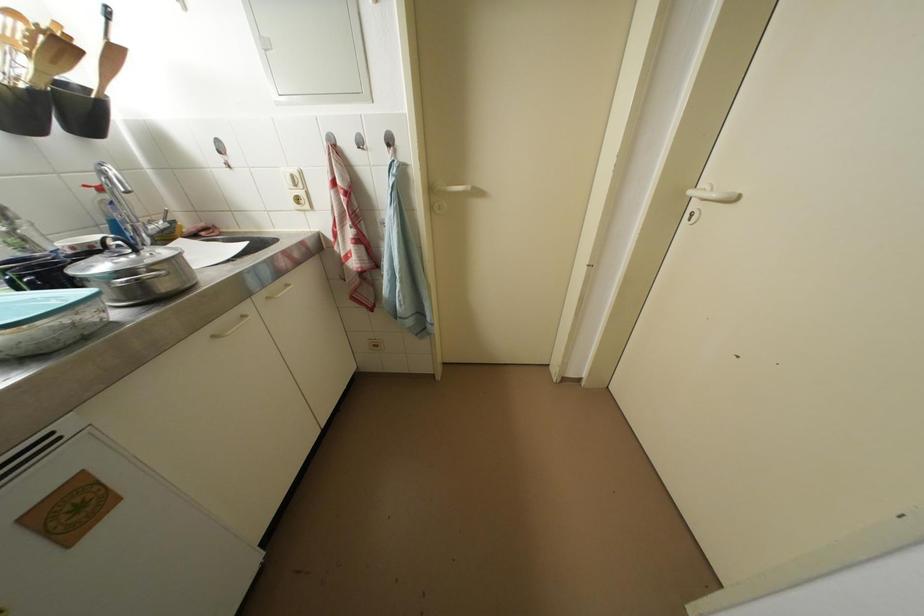
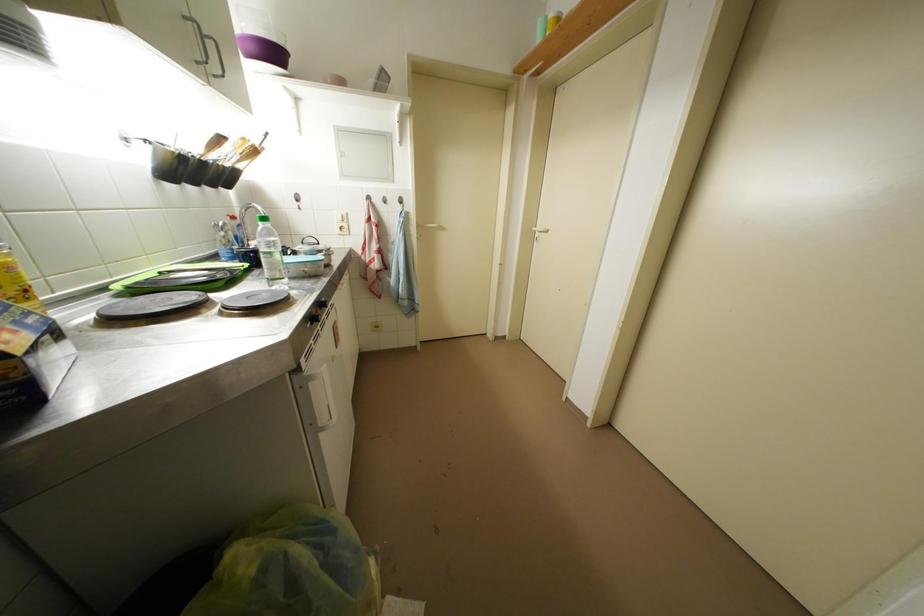
Which direction would the cameraman need to move to produce the second image?

The movement direction of the cameraman is left, backward.